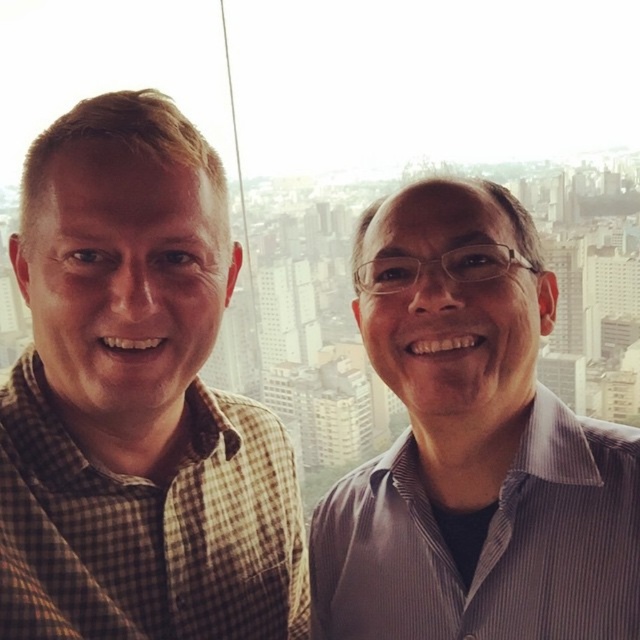
Is point (141, 356) farther from camera compared to point (321, 528)?

No, (141, 356) is in front of (321, 528).

In the scene shown: Who is taller, brown checkered shirt at left or striped shirt at center?

brown checkered shirt at left is taller.

The width and height of the screenshot is (640, 640). I want to click on brown checkered shirt at left, so click(x=136, y=401).